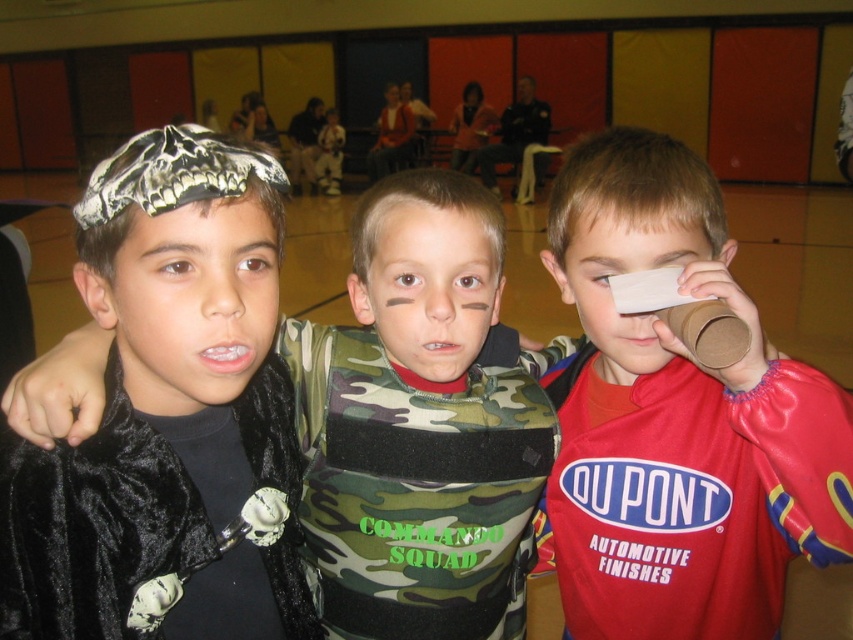
Question: Which object appears farthest from the camera in this image?

Choices:
 (A) matte black headband at center
 (B) velvet black cape at left
 (C) camouflage fabric at center

Answer: (C)

Question: Can you confirm if matte red shirt at center is smaller than red matte paper at right?

Choices:
 (A) yes
 (B) no

Answer: (B)

Question: Which point is closer to the camera?

Choices:
 (A) (688, 256)
 (B) (149, 346)
 (C) (608, 630)
 (D) (454, 244)

Answer: (B)

Question: Where is velvet black cape at left located in relation to matte black headband at center in the image?

Choices:
 (A) above
 (B) below

Answer: (B)

Question: Which point is closer to the camera taking this photo?

Choices:
 (A) (218, 337)
 (B) (16, 632)

Answer: (A)

Question: Is velvet black cape at left to the right of matte black headband at center from the viewer's perspective?

Choices:
 (A) yes
 (B) no

Answer: (B)